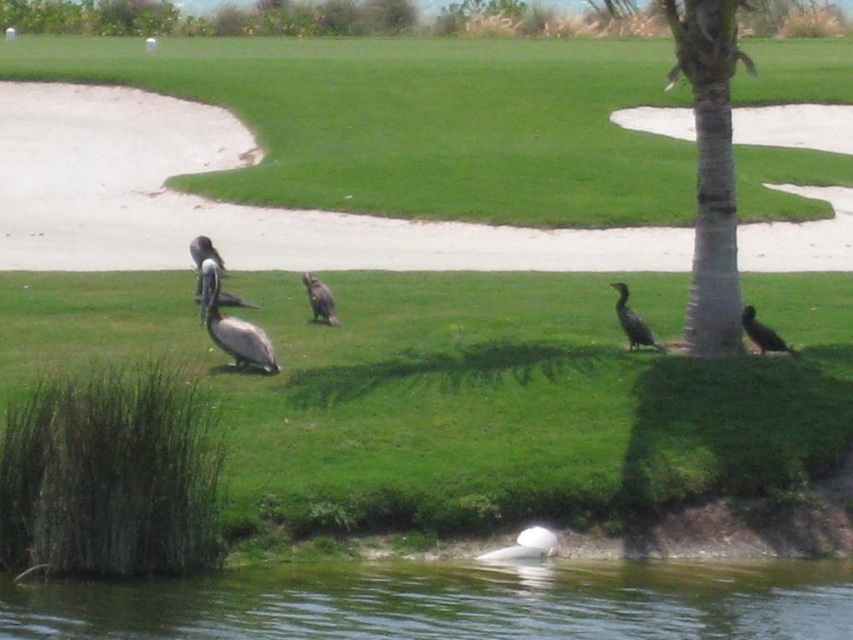
Who is taller, white textured palm tree at right or white feathered duck at lower center?

white textured palm tree at right

Between point (711, 208) and point (520, 538), which one is positioned in front?

Point (520, 538) is in front.

Identify the location of white textured palm tree at right. (711, 168).

Which is in front, point (578, 604) or point (190, 244)?

Point (578, 604) is more forward.

Where is `greenish water at lower center`? Image resolution: width=853 pixels, height=640 pixels. greenish water at lower center is located at coordinates (448, 604).

Is white feathered duck at lower center above dark brown feathers at center?

Actually, white feathered duck at lower center is below dark brown feathers at center.

In the scene shown: Is white feathered duck at lower center to the left of dark brown feathers at center from the viewer's perspective?

Yes, white feathered duck at lower center is to the left of dark brown feathers at center.

Between point (541, 536) and point (747, 305), which one is positioned in front?

Point (541, 536) is in front.

The height and width of the screenshot is (640, 853). I want to click on white feathered duck at lower center, so click(525, 547).